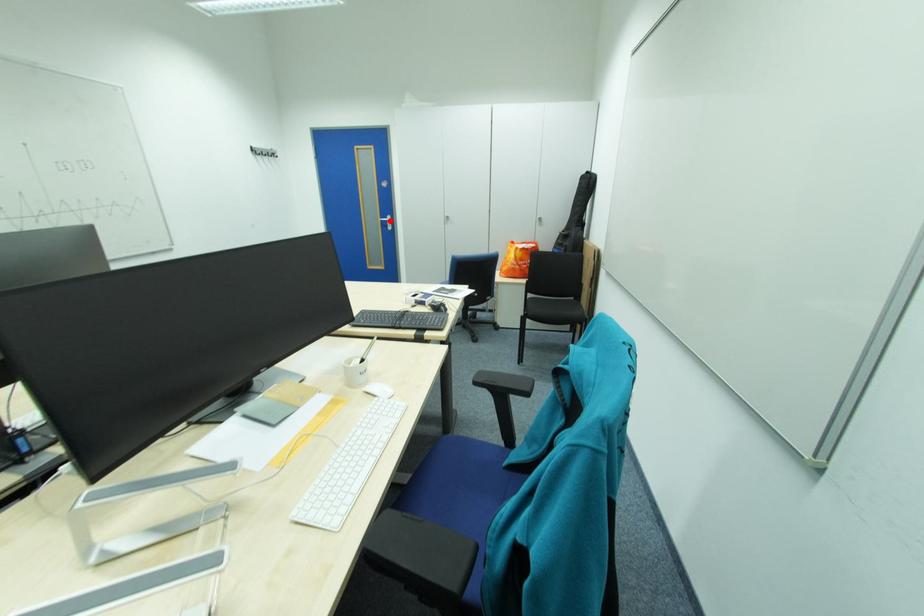
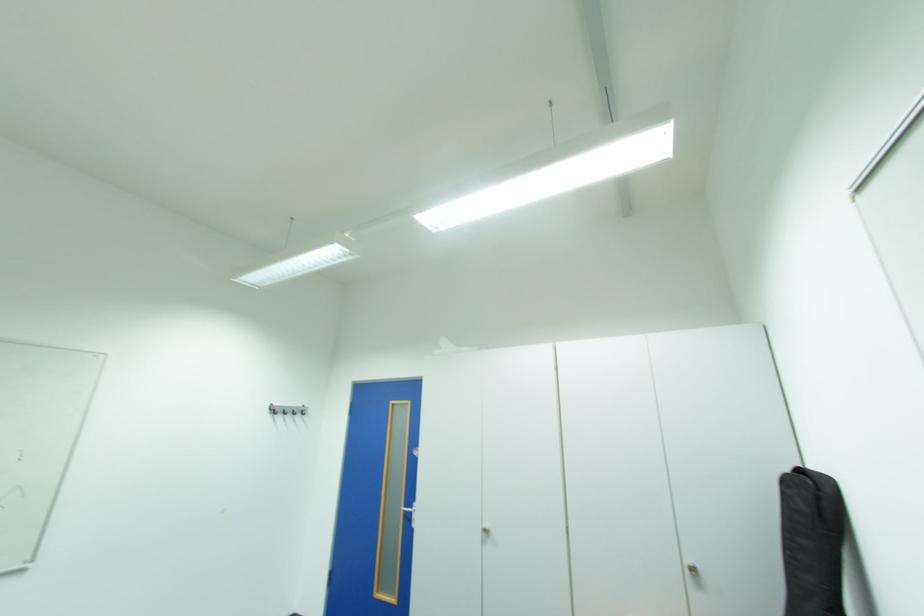
Find the pixel in the second image that matches the highlighted location in the first image.

(414, 511)